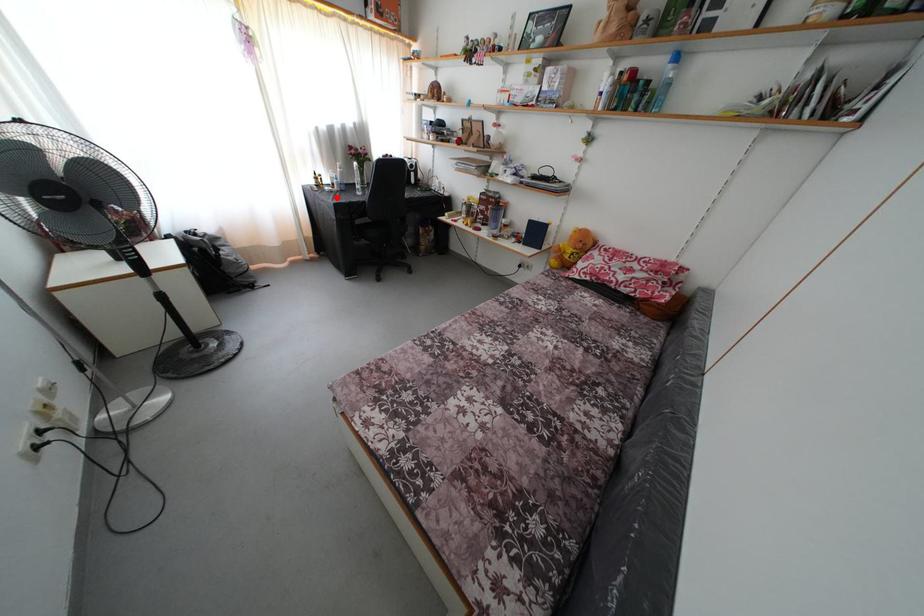
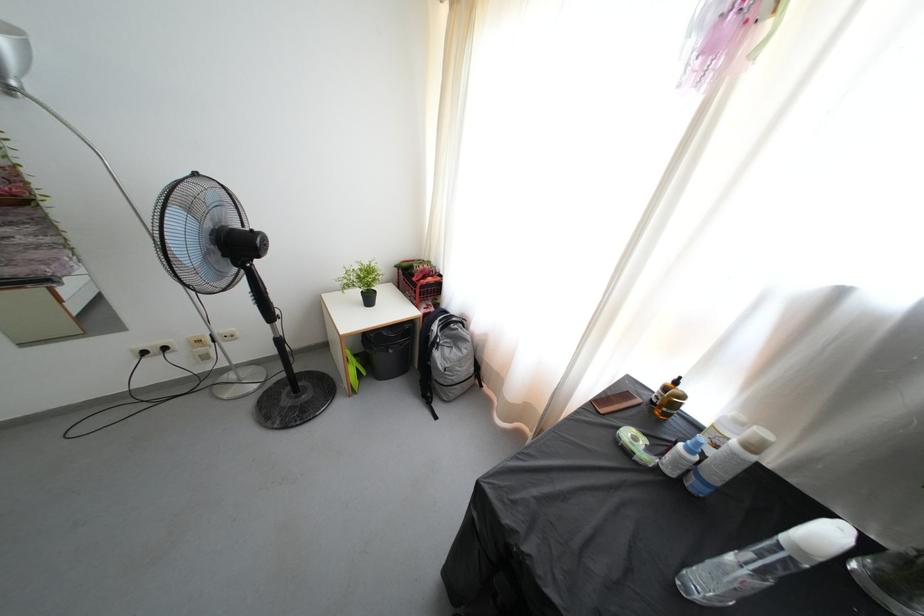
Question: I am providing you with two images of the same scene from different viewpoints. Given a red point in image1, look at the same physical point in image2. Is it:

Choices:
 (A) Closer to the viewpoint
 (B) Farther from the viewpoint

Answer: (B)